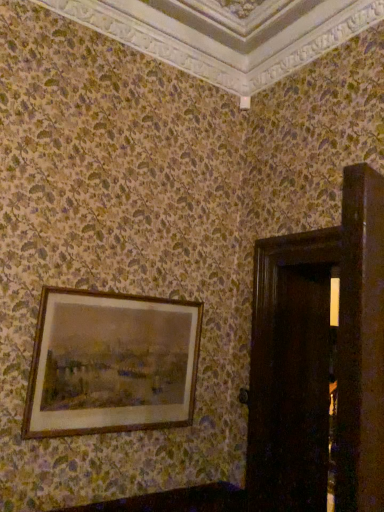
Question: From their relative heights in the image, would you say wooden frame at upper left is taller or shorter than dark wood door at right?

Choices:
 (A) short
 (B) tall

Answer: (A)

Question: Based on their sizes in the image, would you say wooden frame at upper left is bigger or smaller than dark wood door at right?

Choices:
 (A) big
 (B) small

Answer: (B)

Question: Considering their positions, is wooden frame at upper left located in front of or behind dark wood door at right?

Choices:
 (A) front
 (B) behind

Answer: (B)

Question: Is dark wood door at right in front of or behind wooden frame at upper left in the image?

Choices:
 (A) behind
 (B) front

Answer: (B)

Question: In terms of width, does dark wood door at right look wider or thinner when compared to wooden frame at upper left?

Choices:
 (A) thin
 (B) wide

Answer: (B)

Question: Based on their positions, is dark wood door at right located to the left or right of wooden frame at upper left?

Choices:
 (A) right
 (B) left

Answer: (A)

Question: Is dark wood door at right situated inside wooden frame at upper left or outside?

Choices:
 (A) inside
 (B) outside

Answer: (B)